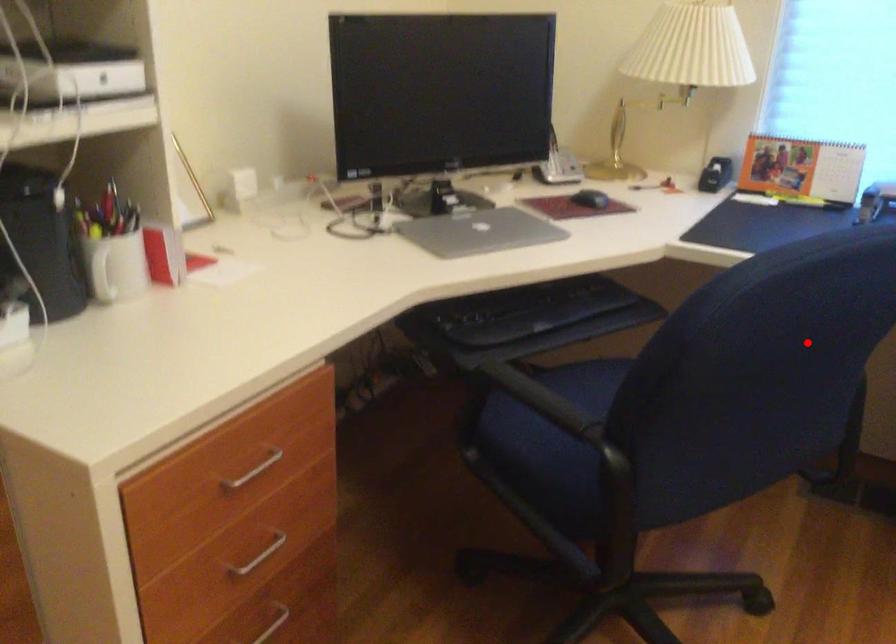
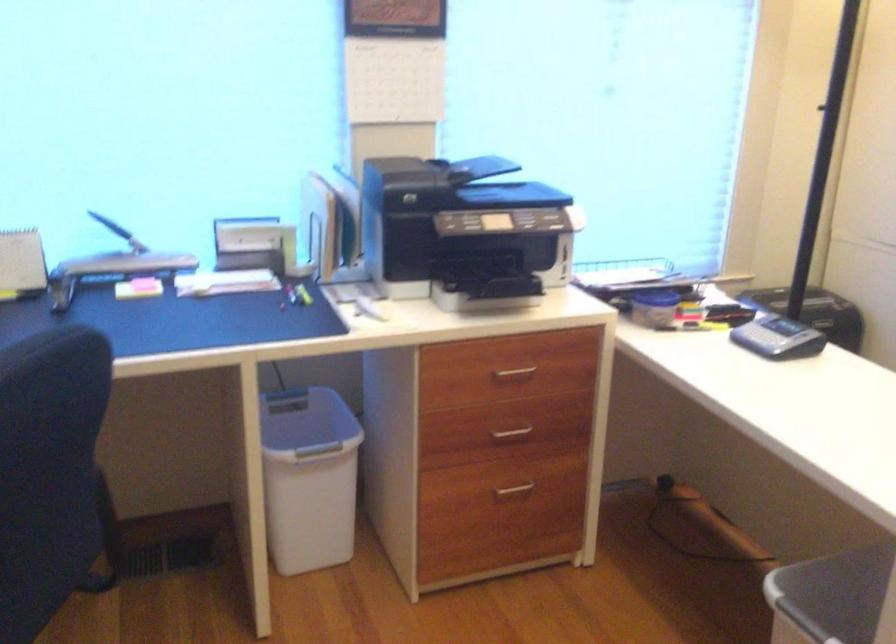
Find the pixel in the second image that matches the highlighted location in the first image.

(48, 471)